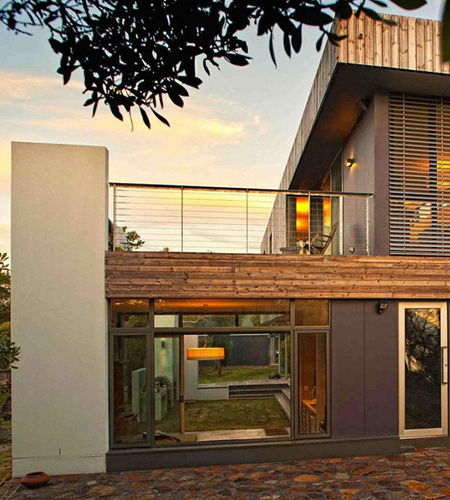
In order to click on door in this screenshot , I will do `click(418, 361)`.